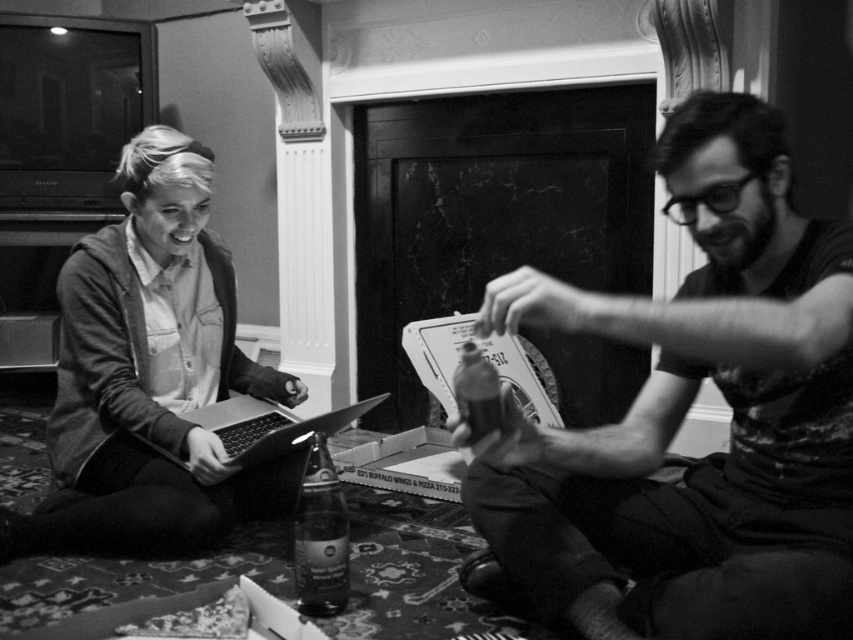
Based on the scene description, where is the denim jacket at left located in terms of its 2D coordinates?

The denim jacket at left is located at the 2D coordinates of point [148,374].

You are standing in the room and want to hand a book to the person wearing the denim jacket at left without disturbing the metallic silver laptop at center. Which object should you approach first?

The denim jacket at left is closer to you than the metallic silver laptop at center, so you should approach the denim jacket at left first to hand the book without disturbing the laptop.

You are a photographer who wants to capture a closeup of the clear glass bottle at center and the matte black shirt at center in the scene. Which object should you focus on first if you want to ensure both are in focus without adjusting the camera settings?

The clear glass bottle at center should be focused on first because the matte black shirt at center is to the right of it, so focusing on the closer object first allows both to be in focus when using a fixed focal plane.